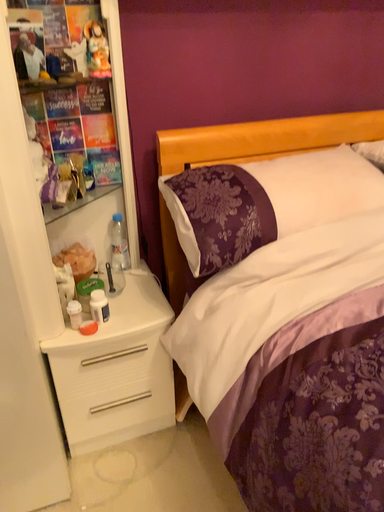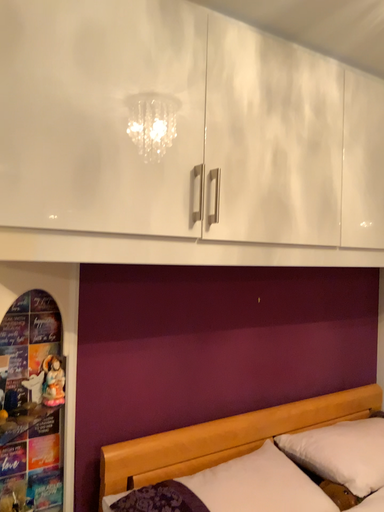
Question: Which way did the camera rotate in the video?

Choices:
 (A) rotated right
 (B) rotated left

Answer: (A)